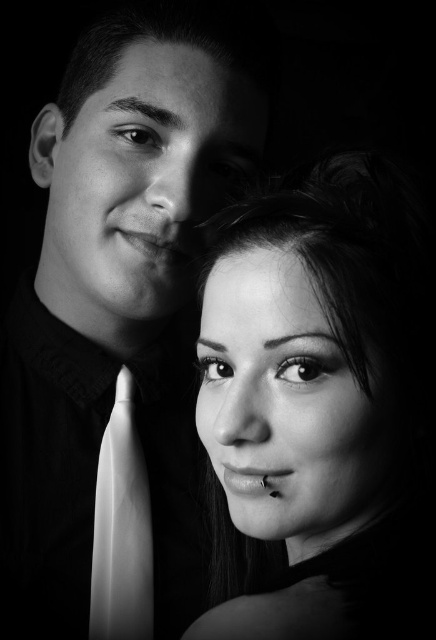
Consider the image. Looking at the black and white portrait, you notice the smooth skin face at center and the white silk tie at left. Which object takes up more space in the image?

The smooth skin face at center has a larger size compared to the white silk tie at left, so it takes up more space in the image.

You are a photographer reviewing this black and white portrait. You notice the smooth skin face at center and the white silk tie at left. Based on their positions, which object is closer to the left edge of the image?

The white silk tie at left is closer to the left edge of the image because it is positioned to the left of the smooth skin face at center.

In the black and white portrait, there are two people. The man is slightly behind the woman, who has a small nose piercing. The point at coordinates point (316, 403) is part of the smooth skin face at center. Which person does this point belong to?

The point at coordinates point (316, 403) belongs to the smooth skin face at center, which is the woman since she is in the foreground with her face more brightly lit and features highlighted clearly.